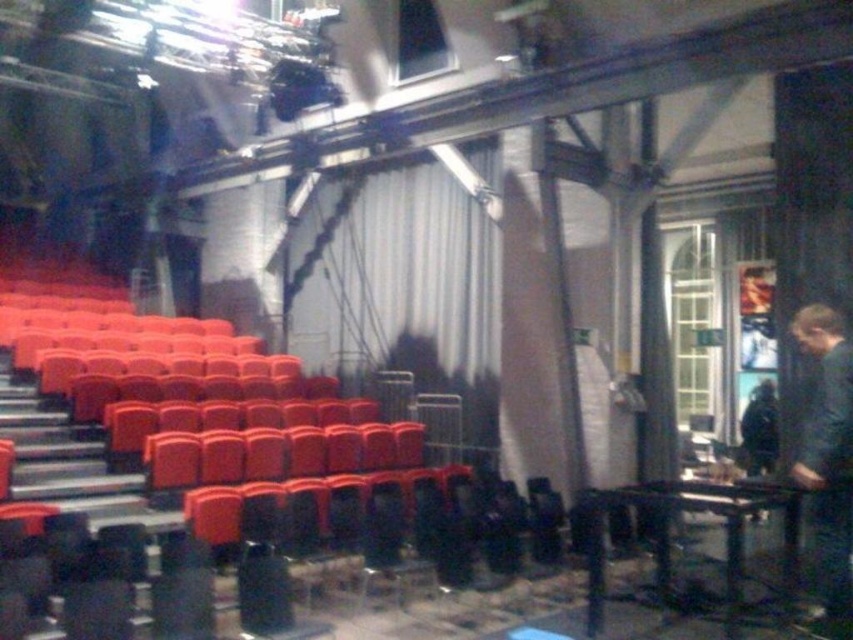
You are a stagehand preparing to adjust the lighting for a performance. You need to position a spotlight so that it can illuminate the white matte curtain at center effectively. Given that the spotlight has a maximum effective range of 8 meters, will it reach the curtain?

The white matte curtain at center is 8.11 meters away from the camera. Since the spotlight has a maximum effective range of 8 meters, it will not reach the curtain as the distance exceeds its capability.

You are an event planner setting up for a presentation. You need to determine the placement of a projector screen. The projector will be placed behind the audience seats. Which object, the white matte curtain at center or the dark blue fabric at right, would be a better choice for mounting the screen due to its position relative to the seating area?

The white matte curtain at center is located above the dark blue fabric at right, so it is positioned higher up. Since the projector is behind the audience seats, mounting the screen on the white matte curtain at center would ensure a better line of sight for the audience.

You are an event planner setting up for a presentation. You have a white matte curtain at center and a dark blue fabric at right. Which one can you use to cover a 3.5 meter wide stage backdrop without needing to join multiple pieces together?

The white matte curtain at center might be wider than dark blue fabric at right, so it is possible that the white matte curtain at center can cover the 3.5 meter wide stage backdrop without needing to join multiple pieces together.